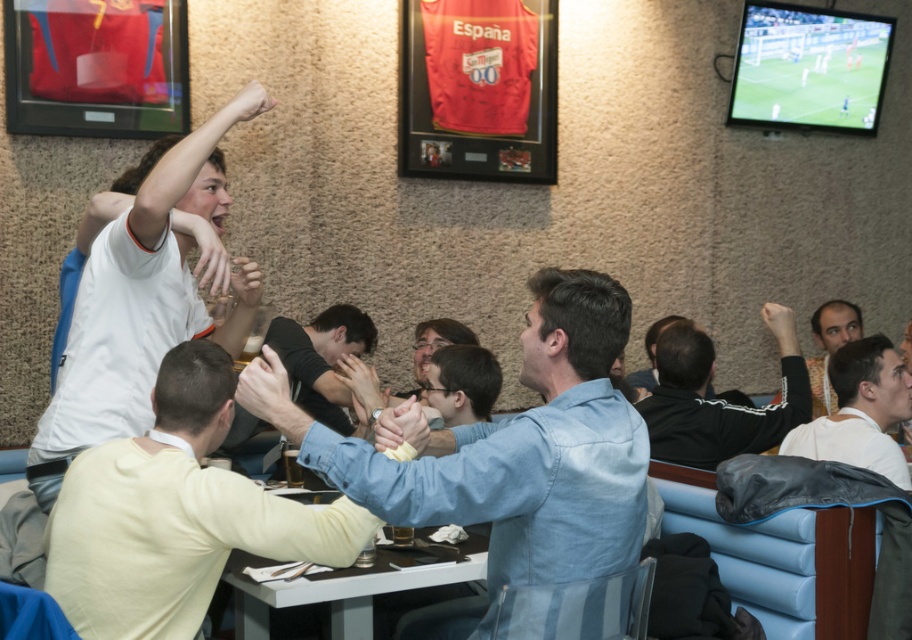
Question: Which point appears closest to the camera in this image?

Choices:
 (A) (710, 388)
 (B) (100, 259)
 (C) (534, 372)

Answer: (C)

Question: Is the position of light yellow sweater at center more distant than that of light beige sweater at center?

Choices:
 (A) no
 (B) yes

Answer: (A)

Question: Which object is closer to the camera taking this photo?

Choices:
 (A) black jersey at center
 (B) light yellow sweater at center

Answer: (B)

Question: Which point appears farthest from the camera in this image?

Choices:
 (A) (356, 330)
 (B) (107, 387)
 (C) (670, 369)

Answer: (A)

Question: Is black jersey at center positioned in front of dark blue shirt at center?

Choices:
 (A) no
 (B) yes

Answer: (A)

Question: Observing the image, what is the correct spatial positioning of light beige sweater at center in reference to dark brown hair at center?

Choices:
 (A) above
 (B) below

Answer: (B)